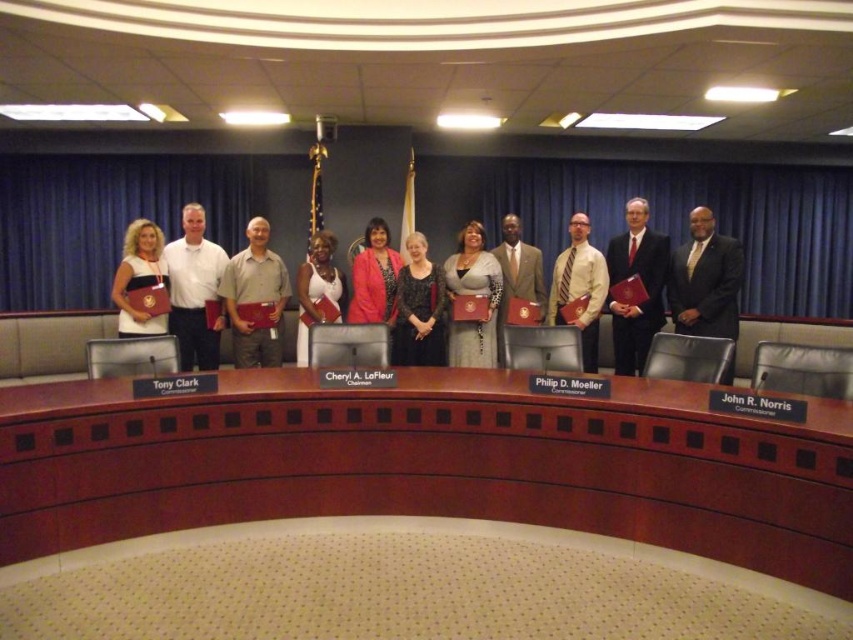
Who is positioned more to the right, black suit at center or matte black dress at left?

black suit at center is more to the right.

Does black suit at center have a lesser height compared to matte black dress at left?

In fact, black suit at center may be taller than matte black dress at left.

Locate an element on the screen. black suit at center is located at coordinates (705, 280).

Where is `black suit at center`? black suit at center is located at coordinates (705, 280).

Who is shorter, matte gray shirt at center or matte brown suit at center?

matte gray shirt at center

Can you confirm if matte gray shirt at center is smaller than matte brown suit at center?

Indeed, matte gray shirt at center has a smaller size compared to matte brown suit at center.

Between point (271, 321) and point (535, 292), which one is positioned behind?

Point (535, 292)

The image size is (853, 640). I want to click on matte gray shirt at center, so click(x=254, y=298).

Looking at this image, does black suit at center appear on the right side of matte brown suit at center?

Yes, black suit at center is to the right of matte brown suit at center.

At what (x,y) coordinates should I click in order to perform the action: click on black suit at center. Please return your answer as a coordinate pair (x, y). Looking at the image, I should click on (705, 280).

Identify the location of black suit at center. Image resolution: width=853 pixels, height=640 pixels. (705, 280).

The height and width of the screenshot is (640, 853). What are the coordinates of `black suit at center` in the screenshot? It's located at (705, 280).